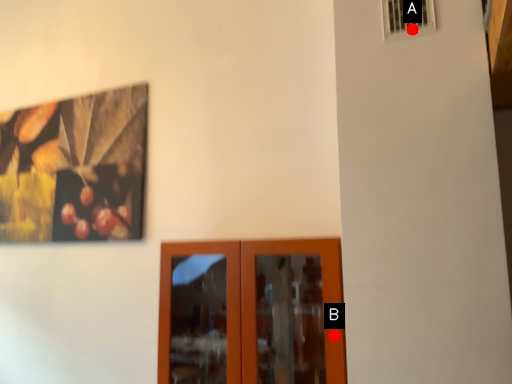
Question: Two points are circled on the image, labeled by A and B beside each circle. Which point appears farthest from the camera in this image?

Choices:
 (A) A is further
 (B) B is further

Answer: (B)